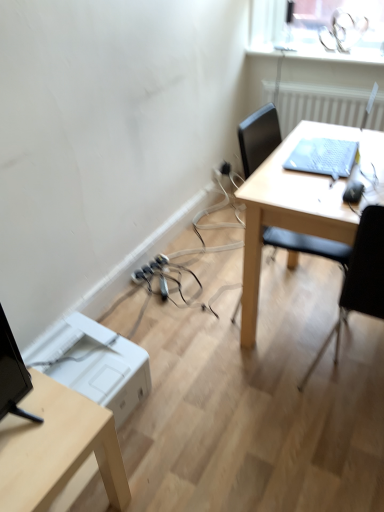
Image resolution: width=384 pixels, height=512 pixels. Find the location of `vacant area situated to the left side of light wood table at center`. vacant area situated to the left side of light wood table at center is located at coordinates (196, 332).